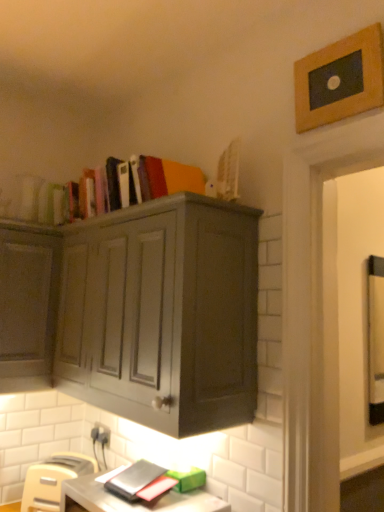
Question: Is the position of beige plastic toaster at lower left more distant than that of matte gray desk at lower center?

Choices:
 (A) yes
 (B) no

Answer: (A)

Question: Does beige plastic toaster at lower left come in front of matte gray desk at lower center?

Choices:
 (A) no
 (B) yes

Answer: (A)

Question: Would you consider beige plastic toaster at lower left to be distant from matte gray desk at lower center?

Choices:
 (A) yes
 (B) no

Answer: (B)

Question: Can you confirm if beige plastic toaster at lower left is taller than matte gray desk at lower center?

Choices:
 (A) yes
 (B) no

Answer: (A)

Question: From the image's perspective, is beige plastic toaster at lower left located beneath matte gray desk at lower center?

Choices:
 (A) no
 (B) yes

Answer: (B)

Question: Can you confirm if beige plastic toaster at lower left is thinner than matte gray desk at lower center?

Choices:
 (A) no
 (B) yes

Answer: (B)

Question: Does wooden picture frame at upper right have a smaller size compared to matte hardcover books at upper center?

Choices:
 (A) no
 (B) yes

Answer: (B)

Question: From a real-world perspective, is wooden picture frame at upper right located beneath matte hardcover books at upper center?

Choices:
 (A) no
 (B) yes

Answer: (A)

Question: Considering the relative sizes of wooden picture frame at upper right and matte hardcover books at upper center in the image provided, is wooden picture frame at upper right taller than matte hardcover books at upper center?

Choices:
 (A) no
 (B) yes

Answer: (A)

Question: Is wooden picture frame at upper right thinner than matte hardcover books at upper center?

Choices:
 (A) no
 (B) yes

Answer: (B)

Question: Is wooden picture frame at upper right wider than matte hardcover books at upper center?

Choices:
 (A) no
 (B) yes

Answer: (A)

Question: Is wooden picture frame at upper right not close to matte hardcover books at upper center?

Choices:
 (A) no
 (B) yes

Answer: (A)

Question: Does matte gray desk at lower center appear on the right side of beige plastic toaster at lower left?

Choices:
 (A) yes
 (B) no

Answer: (A)